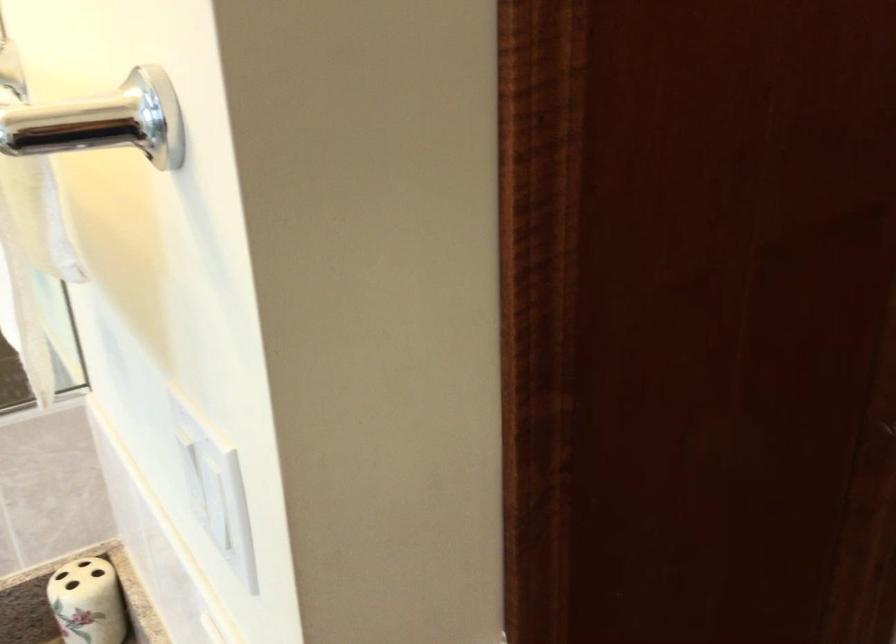
Locate an element on the screen. chrome towel bar is located at coordinates (102, 122).